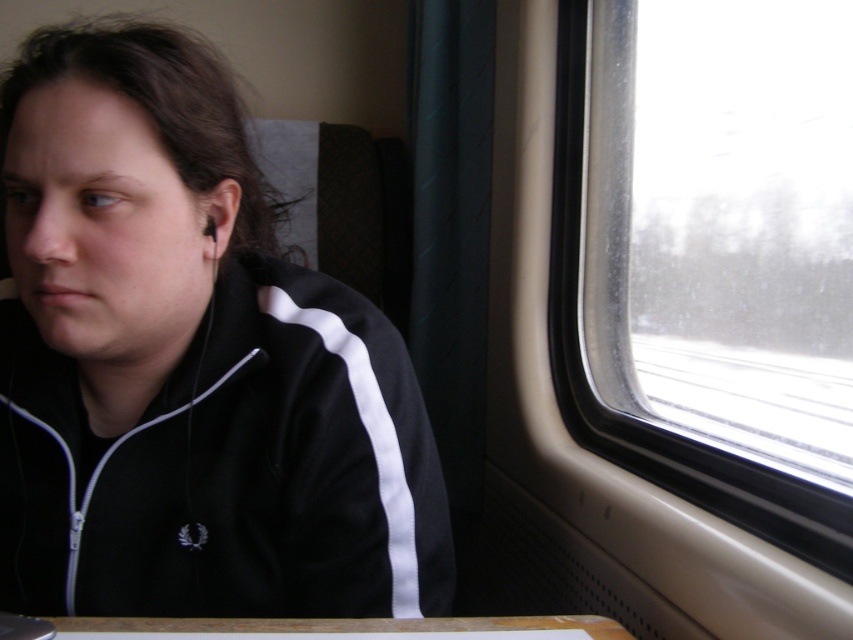
Question: Which of the following is the farthest from the observer?

Choices:
 (A) (546, 634)
 (B) (202, 385)

Answer: (B)

Question: Is black matte jacket at left bigger than wooden table at lower center?

Choices:
 (A) no
 (B) yes

Answer: (B)

Question: Is black matte jacket at left positioned behind transparent glass window at right?

Choices:
 (A) no
 (B) yes

Answer: (A)

Question: Is black matte jacket at left positioned behind transparent glass window at right?

Choices:
 (A) no
 (B) yes

Answer: (A)

Question: Which object is farther from the camera taking this photo?

Choices:
 (A) wooden table at lower center
 (B) black matte jacket at left
 (C) transparent glass window at right

Answer: (C)

Question: Among these objects, which one is farthest from the camera?

Choices:
 (A) wooden table at lower center
 (B) black matte jacket at left
 (C) transparent glass window at right

Answer: (C)